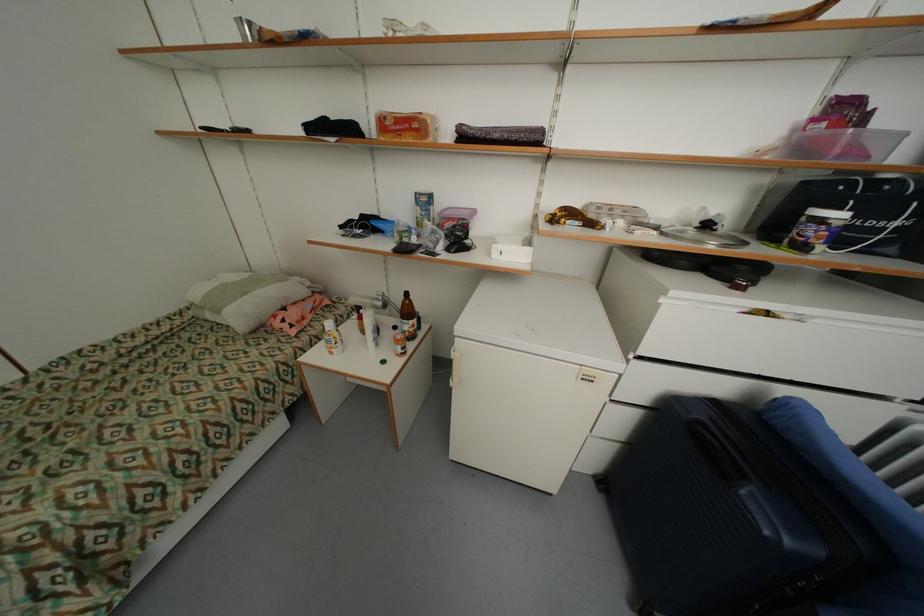
Where would you lift the white tissue box? Please return your answer as a coordinate pair (x, y).

(512, 249)